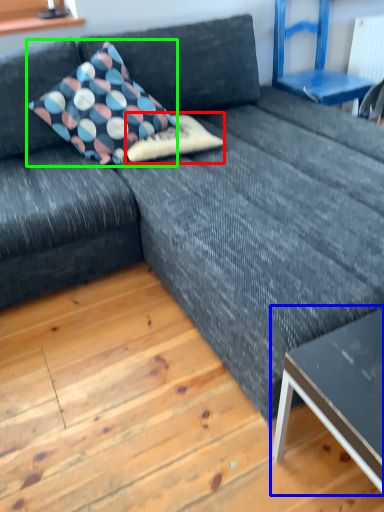
Question: Which object is the closest to the pillow (highlighted by a red box)? Choose among these: table (highlighted by a blue box) or pillow (highlighted by a green box).

Choices:
 (A) table
 (B) pillow

Answer: (B)